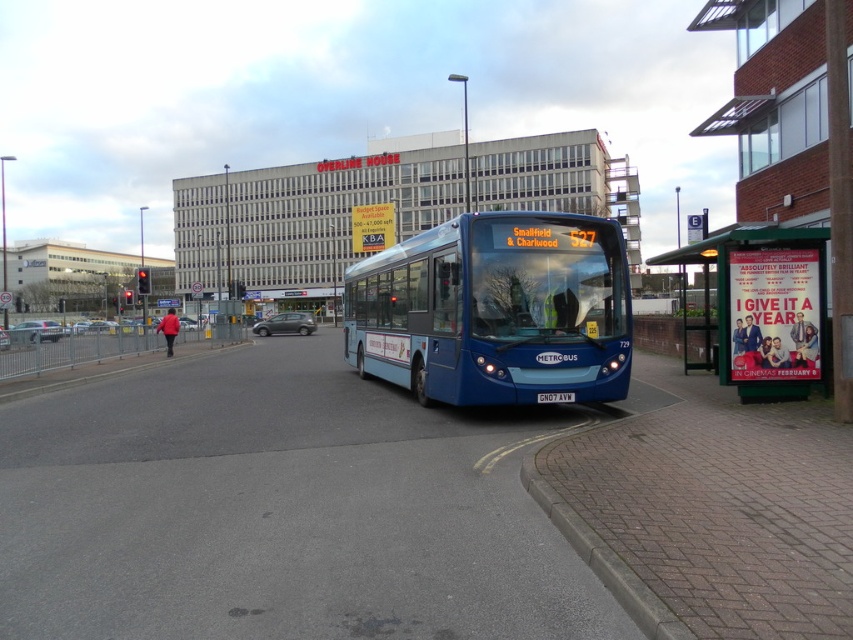
Question: Considering the relative positions of brick pavement at lower right and metallic green bus stop at right in the image provided, where is brick pavement at lower right located with respect to metallic green bus stop at right?

Choices:
 (A) below
 (B) above

Answer: (A)

Question: Is brick pavement at lower right to the left of blue metallic bus at center from the viewer's perspective?

Choices:
 (A) yes
 (B) no

Answer: (A)

Question: Which point is farther from the camera taking this photo?

Choices:
 (A) (769, 376)
 (B) (532, 257)
 (C) (79, 468)

Answer: (A)

Question: Which object is the closest to the brick pavement at lower right?

Choices:
 (A) metallic green bus stop at right
 (B) blue metallic bus at center

Answer: (B)

Question: Is blue metallic bus at center bigger than metallic green bus stop at right?

Choices:
 (A) no
 (B) yes

Answer: (B)

Question: Which point appears farthest from the camera in this image?

Choices:
 (A) (509, 371)
 (B) (102, 488)
 (C) (776, 236)

Answer: (A)